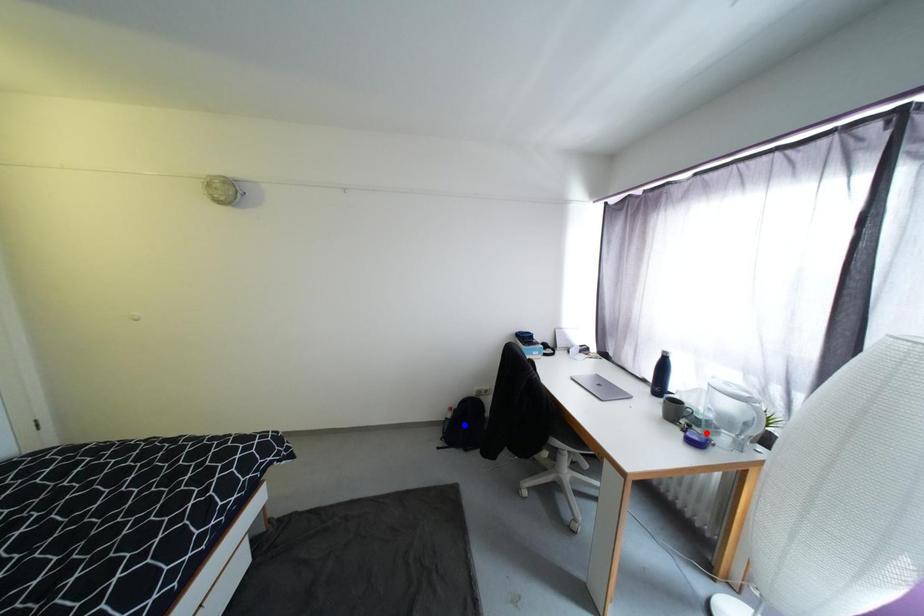
Question: Which of the two points in the image is closer to the camera?

Choices:
 (A) Blue point is closer.
 (B) Red point is closer.

Answer: (B)